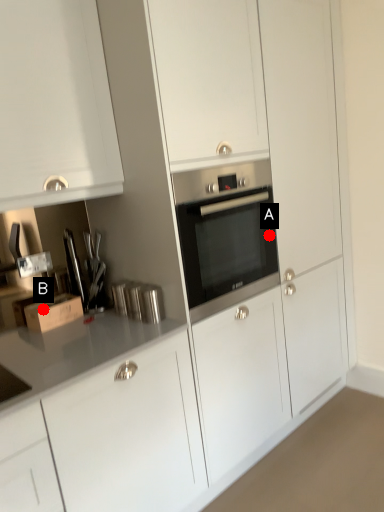
Question: Two points are circled on the image, labeled by A and B beside each circle. Which point is further to the camera?

Choices:
 (A) A is further
 (B) B is further

Answer: (A)